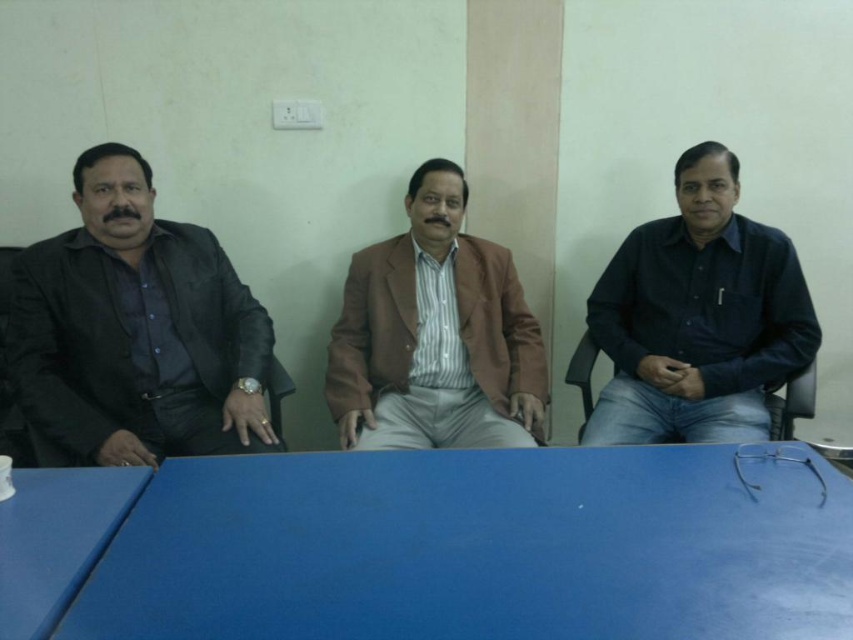
Question: Does matte black jacket at left have a greater width compared to dark blue shirt at right?

Choices:
 (A) yes
 (B) no

Answer: (B)

Question: Which point is farther to the camera?

Choices:
 (A) brown textured blazer at center
 (B) blue matte table at center
 (C) dark blue shirt at right

Answer: (C)

Question: Can you confirm if blue matte table at center is positioned to the left of blue plastic table at lower left?

Choices:
 (A) yes
 (B) no

Answer: (B)

Question: Does dark blue shirt at right have a greater width compared to blue plastic table at lower left?

Choices:
 (A) no
 (B) yes

Answer: (B)

Question: Which of the following is the farthest from the observer?

Choices:
 (A) brown textured blazer at center
 (B) matte black jacket at left

Answer: (A)

Question: Among these objects, which one is farthest from the camera?

Choices:
 (A) matte black jacket at left
 (B) dark blue shirt at right
 (C) blue plastic table at lower left

Answer: (B)